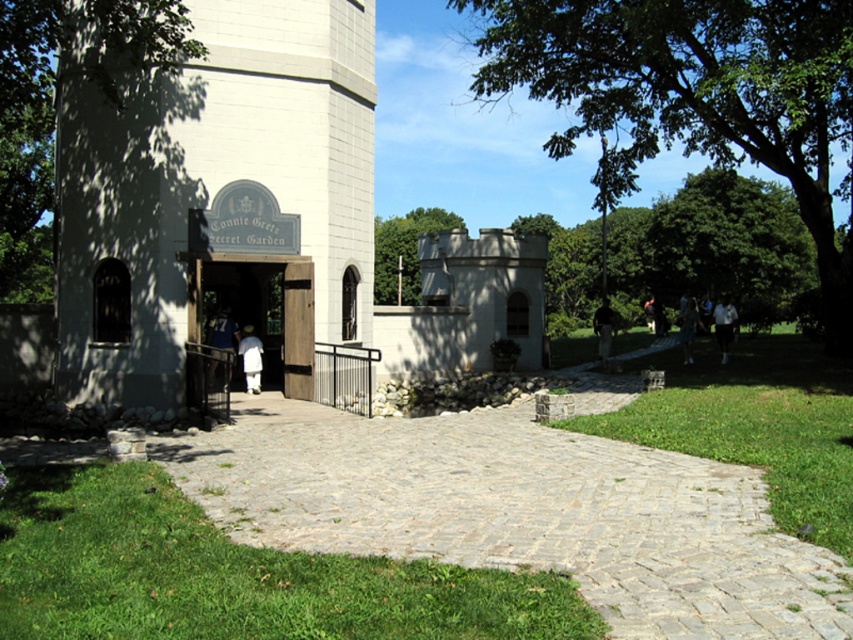
Question: Which of the following is the closest to the observer?

Choices:
 (A) (x=389, y=257)
 (B) (x=161, y=60)
 (C) (x=699, y=36)
 (D) (x=689, y=481)

Answer: (D)

Question: Is green leafy tree at left to the right of green leafy tree at center from the viewer's perspective?

Choices:
 (A) yes
 (B) no

Answer: (B)

Question: Which of the following is the closest to the observer?

Choices:
 (A) green leafy tree at center
 (B) green leafy tree at left
 (C) gray cobblestone path at center

Answer: (C)

Question: Is green leafy tree at upper right to the right of green leafy tree at center from the viewer's perspective?

Choices:
 (A) yes
 (B) no

Answer: (A)

Question: Can you confirm if white stone chapel at center is thinner than gray cobblestone path at center?

Choices:
 (A) yes
 (B) no

Answer: (A)

Question: Estimate the real-world distances between objects in this image. Which object is closer to the wooden door at center?

Choices:
 (A) white stone chapel at center
 (B) gray cobblestone path at center
 (C) green leafy tree at upper right
 (D) green leafy tree at center

Answer: (A)